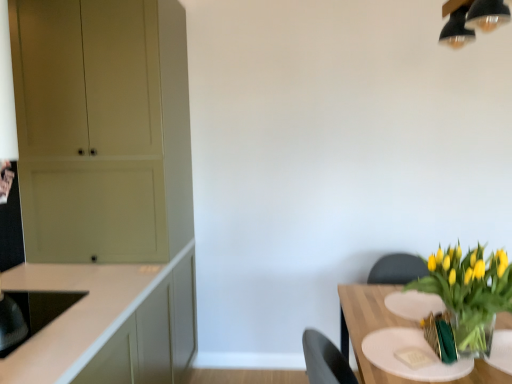
Locate an element on the screen. Image resolution: width=512 pixels, height=384 pixels. white matte cabinet at left, positioned as the 1th cabinetry in front-to-back order is located at coordinates (109, 323).

Where is `translucent glass vase at lower right`? The height and width of the screenshot is (384, 512). translucent glass vase at lower right is located at coordinates (470, 293).

Measure the distance between point [26,321] and camera.

Point [26,321] and camera are 4.93 feet apart.

What do you see at coordinates (102, 129) in the screenshot? This screenshot has height=384, width=512. I see `matte beige cabinet at left, the 2th cabinetry in the front-to-back sequence` at bounding box center [102, 129].

What is the approximate width of matte beige cabinet at left, the 2th cabinetry in the front-to-back sequence?

matte beige cabinet at left, the 2th cabinetry in the front-to-back sequence, is 25.80 inches in width.

Where is `translucent glass table at lower right`? The height and width of the screenshot is (384, 512). translucent glass table at lower right is located at coordinates (368, 325).

Is black glossy sink at lower left to the left of translucent glass table at lower right from the viewer's perspective?

Yes.

Is black glossy sink at lower left oriented away from translucent glass table at lower right?

A: No, black glossy sink at lower left is not facing the opposite direction of translucent glass table at lower right.

From a real-world perspective, which object stands above the other?

black glossy sink at lower left, from a real-world perspective.

Is point (50, 312) farther from viewer compared to point (373, 376)?

Yes, it is.

Considering the relative sizes of black glossy sink at lower left and white matte cabinet at left, arranged as the second cabinetry when viewed from the back, in the image provided, is black glossy sink at lower left taller than white matte cabinet at left, arranged as the second cabinetry when viewed from the back,?

No.

Can you confirm if black glossy sink at lower left is wider than white matte cabinet at left, positioned as the 1th cabinetry in front-to-back order?

In fact, black glossy sink at lower left might be narrower than white matte cabinet at left, positioned as the 1th cabinetry in front-to-back order.

Consider the image. Which is in front, black glossy sink at lower left or white matte cabinet at left, arranged as the second cabinetry when viewed from the back?

white matte cabinet at left, arranged as the second cabinetry when viewed from the back, is in front.

Locate an element on the screen. houseplant above the white matte cabinet at left, positioned as the 1th cabinetry in front-to-back order (from a real-world perspective) is located at coordinates (470, 293).

Considering the points (89, 274) and (504, 276), which point is in front, point (89, 274) or point (504, 276)?

The point (504, 276) is more forward.

Is white matte cabinet at left, positioned as the 1th cabinetry in front-to-back order, taller than translucent glass vase at lower right?

Correct, white matte cabinet at left, positioned as the 1th cabinetry in front-to-back order, is much taller as translucent glass vase at lower right.

Looking at this image, from the image's perspective, between translucent glass table at lower right and white matte cabinet at left, positioned as the 1th cabinetry in front-to-back order, who is located below?

From the image's view, translucent glass table at lower right is below.

Which cabinetry is the 2nd one when counting from the left side of the translucent glass table at lower right? Please provide its 2D coordinates.

[(109, 323)]

Looking at this image, can you confirm if translucent glass table at lower right is taller than white matte cabinet at left, positioned as the 1th cabinetry in front-to-back order?

In fact, translucent glass table at lower right may be shorter than white matte cabinet at left, positioned as the 1th cabinetry in front-to-back order.

Does translucent glass table at lower right come behind white matte cabinet at left, positioned as the 1th cabinetry in front-to-back order?

Yes.

Looking at this image, can you confirm if matte beige cabinet at left, which is the 1th cabinetry from back to front, is smaller than translucent glass table at lower right?

No.

Consider the image. Measure the distance between matte beige cabinet at left, the 2th cabinetry in the front-to-back sequence, and translucent glass table at lower right.

matte beige cabinet at left, the 2th cabinetry in the front-to-back sequence, and translucent glass table at lower right are 4.82 feet apart.

Does matte beige cabinet at left, the 2th cabinetry in the front-to-back sequence, touch translucent glass table at lower right?

There is a gap between matte beige cabinet at left, the 2th cabinetry in the front-to-back sequence, and translucent glass table at lower right.

From a real-world perspective, which object stands above the other?

matte beige cabinet at left, which is the 1th cabinetry from back to front, is physically above.

Is the surface of black glossy sink at lower left in direct contact with matte beige cabinet at left, the 2th cabinetry in the front-to-back sequence?

black glossy sink at lower left is not next to matte beige cabinet at left, the 2th cabinetry in the front-to-back sequence, and they're not touching.

Does black glossy sink at lower left have a lesser width compared to matte beige cabinet at left, which is the 1th cabinetry from back to front?

Yes, black glossy sink at lower left is thinner than matte beige cabinet at left, which is the 1th cabinetry from back to front.

From a real-world perspective, is black glossy sink at lower left beneath matte beige cabinet at left, the 2th cabinetry in the front-to-back sequence?

Yes.

From the image's perspective, between black glossy sink at lower left and matte beige cabinet at left, which is the 1th cabinetry from back to front, who is located below?

From the image's view, black glossy sink at lower left is below.

Which of these two, translucent glass vase at lower right or white matte cabinet at left, positioned as the 1th cabinetry in front-to-back order, stands shorter?

translucent glass vase at lower right.

In the scene shown: Considering the relative sizes of translucent glass vase at lower right and white matte cabinet at left, arranged as the second cabinetry when viewed from the back, in the image provided, is translucent glass vase at lower right wider than white matte cabinet at left, arranged as the second cabinetry when viewed from the back,?

Incorrect, the width of translucent glass vase at lower right does not surpass that of white matte cabinet at left, arranged as the second cabinetry when viewed from the back.

Is translucent glass vase at lower right oriented away from white matte cabinet at left, arranged as the second cabinetry when viewed from the back?

Yes, translucent glass vase at lower right is facing away from white matte cabinet at left, arranged as the second cabinetry when viewed from the back.

Is translucent glass vase at lower right positioned before white matte cabinet at left, arranged as the second cabinetry when viewed from the back?

No, it is not.

Find the location of a particular element. This screenshot has width=512, height=384. table that is under the black glossy sink at lower left (from a real-world perspective) is located at coordinates (368, 325).

Find the location of a particular element. sink above the white matte cabinet at left, arranged as the second cabinetry when viewed from the back (from a real-world perspective) is located at coordinates (39, 310).

Based on their spatial positions, is matte beige cabinet at left, the 2th cabinetry in the front-to-back sequence, or translucent glass vase at lower right further from white matte cabinet at left, positioned as the 1th cabinetry in front-to-back order?

translucent glass vase at lower right.

Based on their spatial positions, is white matte cabinet at left, positioned as the 1th cabinetry in front-to-back order, or translucent glass table at lower right closer to translucent glass vase at lower right?

Among the two, translucent glass table at lower right is located nearer to translucent glass vase at lower right.

Looking at the image, which one is located closer to white matte cabinet at left, positioned as the 1th cabinetry in front-to-back order, black glossy sink at lower left or translucent glass table at lower right?

black glossy sink at lower left is positioned closer to the anchor white matte cabinet at left, positioned as the 1th cabinetry in front-to-back order.

When comparing their distances from translucent glass vase at lower right, does translucent glass table at lower right or matte beige cabinet at left, which is the 1th cabinetry from back to front, seem closer?

translucent glass table at lower right is closer to translucent glass vase at lower right.

Based on their spatial positions, is translucent glass vase at lower right or white matte cabinet at left, positioned as the 1th cabinetry in front-to-back order, further from black glossy sink at lower left?

Based on the image, translucent glass vase at lower right appears to be further to black glossy sink at lower left.

Considering their positions, is white matte cabinet at left, arranged as the second cabinetry when viewed from the back, positioned further to translucent glass table at lower right than translucent glass vase at lower right?

white matte cabinet at left, arranged as the second cabinetry when viewed from the back, lies further to translucent glass table at lower right than the other object.

Based on their spatial positions, is translucent glass vase at lower right or white matte cabinet at left, positioned as the 1th cabinetry in front-to-back order, further from matte beige cabinet at left, the 2th cabinetry in the front-to-back sequence?

The object further to matte beige cabinet at left, the 2th cabinetry in the front-to-back sequence, is translucent glass vase at lower right.

From the picture: Looking at the image, which one is located closer to white matte cabinet at left, positioned as the 1th cabinetry in front-to-back order, translucent glass vase at lower right or matte beige cabinet at left, the 2th cabinetry in the front-to-back sequence?

matte beige cabinet at left, the 2th cabinetry in the front-to-back sequence, lies closer to white matte cabinet at left, positioned as the 1th cabinetry in front-to-back order, than the other object.

Identify the location of sink located between white matte cabinet at left, arranged as the second cabinetry when viewed from the back, and matte beige cabinet at left, the 2th cabinetry in the front-to-back sequence, in the depth direction. (39, 310).

Locate an element on the screen. cabinetry situated between white matte cabinet at left, positioned as the 1th cabinetry in front-to-back order, and translucent glass vase at lower right from left to right is located at coordinates (102, 129).

I want to click on houseplant situated between black glossy sink at lower left and translucent glass table at lower right from left to right, so click(x=470, y=293).

The image size is (512, 384). I want to click on houseplant between white matte cabinet at left, positioned as the 1th cabinetry in front-to-back order, and translucent glass table at lower right, so click(x=470, y=293).